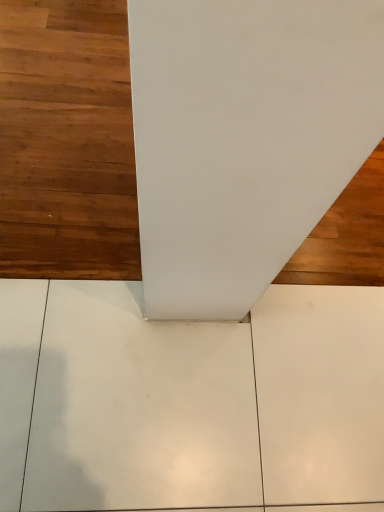
You are a GUI agent. You are given a task and a screenshot of the screen. Output one action in this format:
    pyautogui.click(x=<x>, y=<y>)
    Task: Click on the brown wood floor at upper left
    
    Given the screenshot: What is the action you would take?
    pyautogui.click(x=67, y=142)

The width and height of the screenshot is (384, 512). Describe the element at coordinates (67, 142) in the screenshot. I see `brown wood floor at upper left` at that location.

This screenshot has width=384, height=512. What are the coordinates of `brown wood floor at upper left` in the screenshot? It's located at (67, 142).